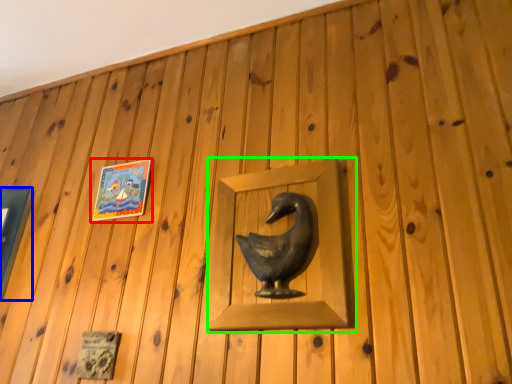
Question: Considering the real-world distances, which object is closest to picture frame (highlighted by a red box)? picture frame (highlighted by a blue box) or sculpture (highlighted by a green box).

Choices:
 (A) picture frame
 (B) sculpture

Answer: (A)